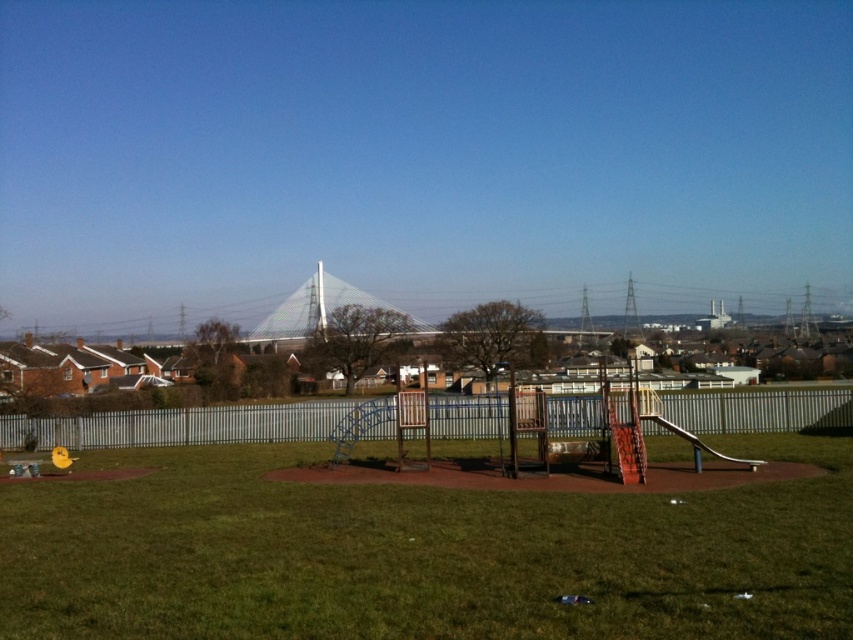
Question: Is green grass at center below metallic silver fence at center?

Choices:
 (A) no
 (B) yes

Answer: (A)

Question: Among these objects, which one is nearest to the camera?

Choices:
 (A) metallic silver fence at center
 (B) green grass at center

Answer: (B)

Question: Does green grass at center appear over metallic silver fence at center?

Choices:
 (A) yes
 (B) no

Answer: (A)

Question: Considering the relative positions of green grass at center and metallic silver fence at center in the image provided, where is green grass at center located with respect to metallic silver fence at center?

Choices:
 (A) right
 (B) left

Answer: (B)